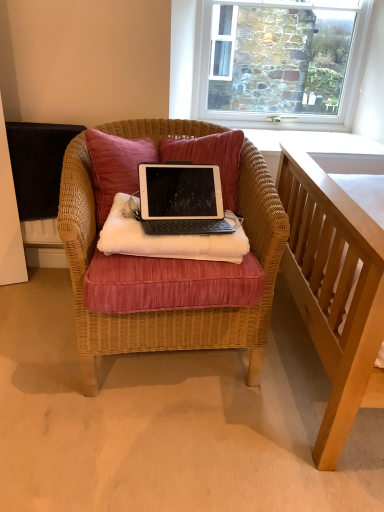
Question: Based on their positions, is woven wicker chair at center located to the left or right of stone textured wall at upper center?

Choices:
 (A) right
 (B) left

Answer: (B)

Question: Looking at their shapes, would you say woven wicker chair at center is wider or thinner than stone textured wall at upper center?

Choices:
 (A) thin
 (B) wide

Answer: (B)

Question: Based on their relative distances, which object is nearer to the velvet pink pillow at center?

Choices:
 (A) stone textured wall at upper center
 (B) silver/black plastic laptop at center
 (C) black matte tablet at center
 (D) woven wicker chair at center

Answer: (B)

Question: Considering the real-world distances, which object is farthest from the stone textured wall at upper center?

Choices:
 (A) silver/black plastic laptop at center
 (B) black matte tablet at center
 (C) woven wicker chair at center
 (D) velvet pink pillow at center

Answer: (B)